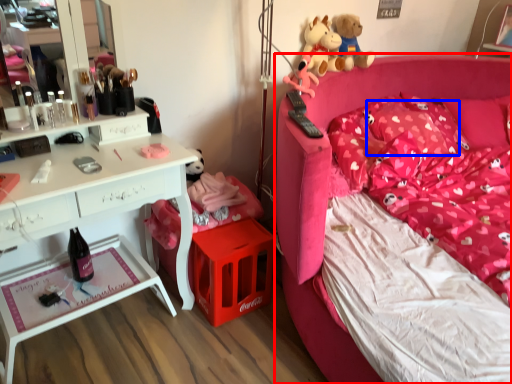
Question: Among these objects, which one is farthest to the camera, bed (highlighted by a red box) or pillow (highlighted by a blue box)?

Choices:
 (A) bed
 (B) pillow

Answer: (B)